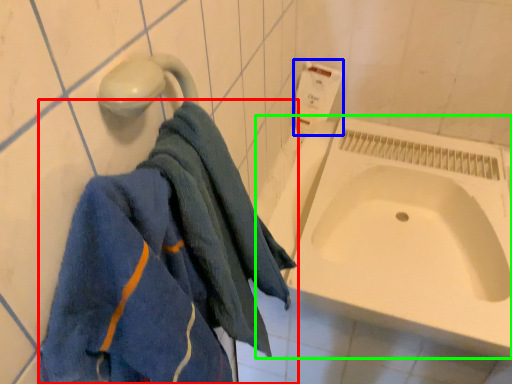
Question: Which is nearer to the towel (highlighted by a red box)? toilet paper (highlighted by a blue box) or bath (highlighted by a green box).

Choices:
 (A) toilet paper
 (B) bath

Answer: (B)